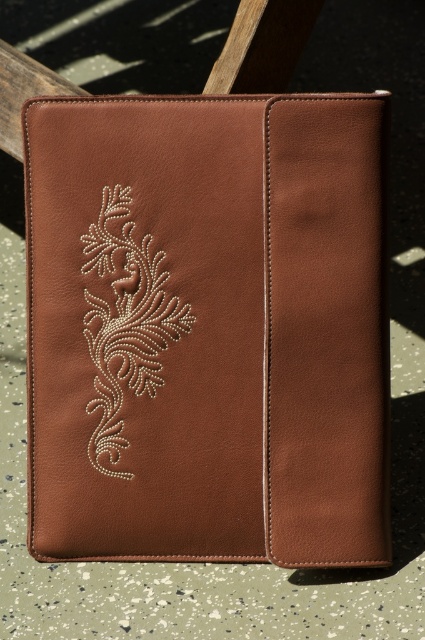
You are organizing items on a desk and need to place the matte leather folder at center and the white beaded floral design at center. Based on the image, which object is positioned higher up?

The matte leather folder at center is above the white beaded floral design at center, so it is positioned higher up.

You are standing in front of a brown leather portfolio on a green surface. There is a point marked at coordinates (207,328). What object is located at that point?

The point at coordinates (207,328) indicates the matte leather folder at center.

You are organizing a craft fair and have a matte leather folder at center and a white beaded floral design at center on your table. Which object takes up more space on the table?

The matte leather folder at center is bigger than the white beaded floral design at center, so it takes up more space on the table.